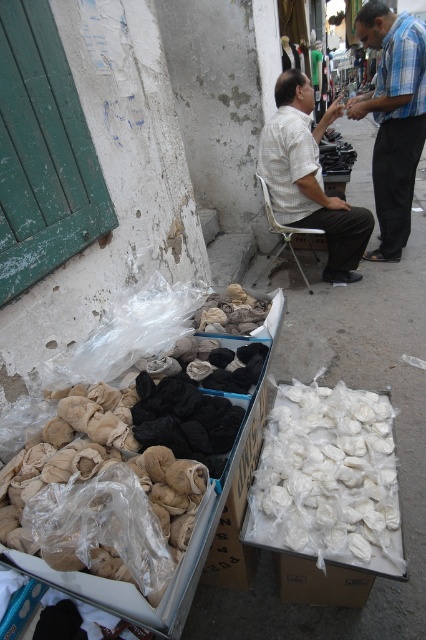
Is point (328, 202) positioned behind point (261, 307)?

Yes, it is.

Is point (273, 212) less distant than point (215, 312)?

No, it is behind (215, 312).

The width and height of the screenshot is (426, 640). What do you see at coordinates (308, 177) in the screenshot?
I see `white textured shirt at center` at bounding box center [308, 177].

Image resolution: width=426 pixels, height=640 pixels. Identify the location of white textured shirt at center. (308, 177).

In the scene shown: Between white textured shirt at center and metallic silver chair at center, which one is positioned higher?

white textured shirt at center is above.

Describe the element at coordinates (308, 177) in the screenshot. I see `white textured shirt at center` at that location.

Identify the location of white textured shirt at center. click(x=308, y=177).

Between beige fabric at center and metallic silver chair at center, which one appears on the left side from the viewer's perspective?

Positioned to the left is beige fabric at center.

How far apart are beige fabric at center and metallic silver chair at center?

beige fabric at center is 1.81 meters away from metallic silver chair at center.

Describe the element at coordinates (232, 310) in the screenshot. I see `beige fabric at center` at that location.

Where is `beige fabric at center`? beige fabric at center is located at coordinates (232, 310).